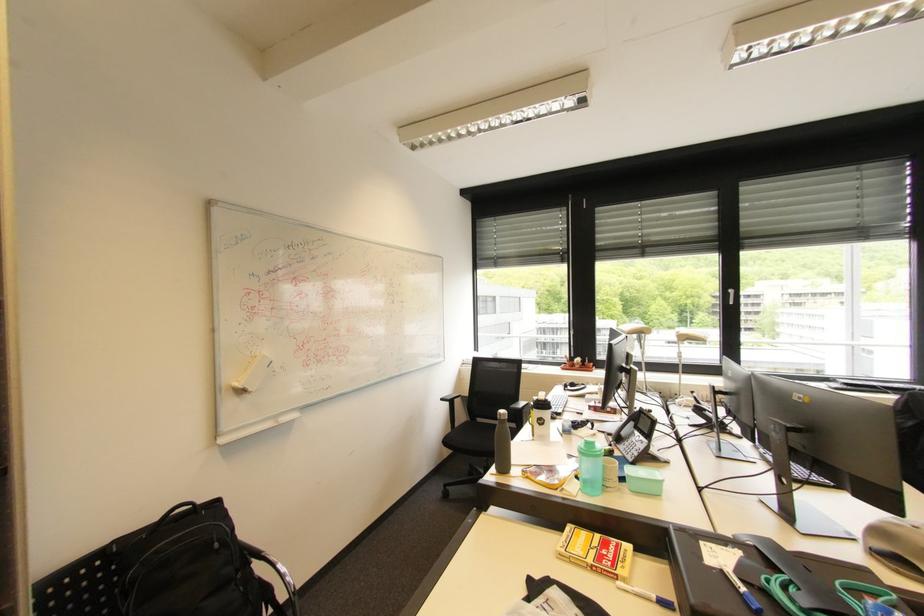
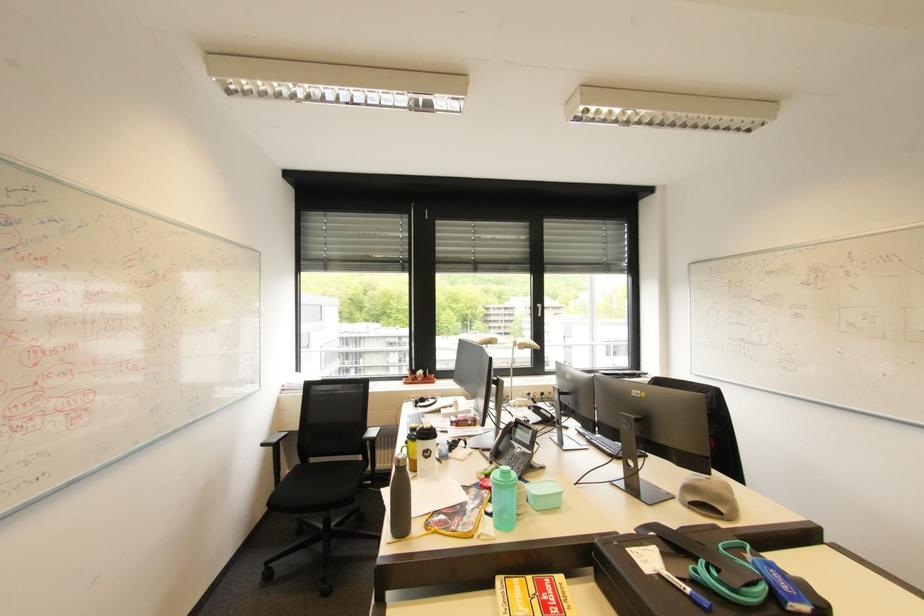
Find the pixel in the second image that matches [476,426] in the first image.

(308, 469)